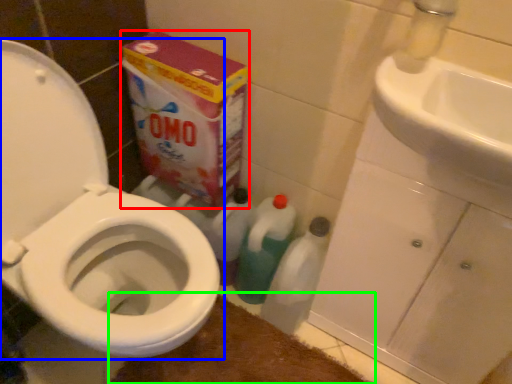
Question: Which object is positioned farthest from cardboard box (highlighted by a red box)? Select from toilet (highlighted by a blue box) and bath mat (highlighted by a green box).

Choices:
 (A) toilet
 (B) bath mat

Answer: (B)